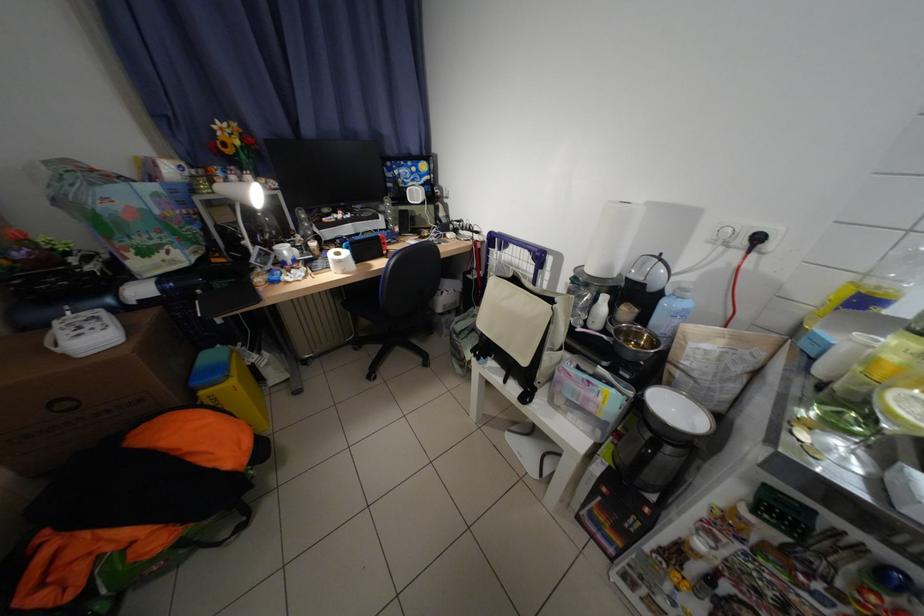
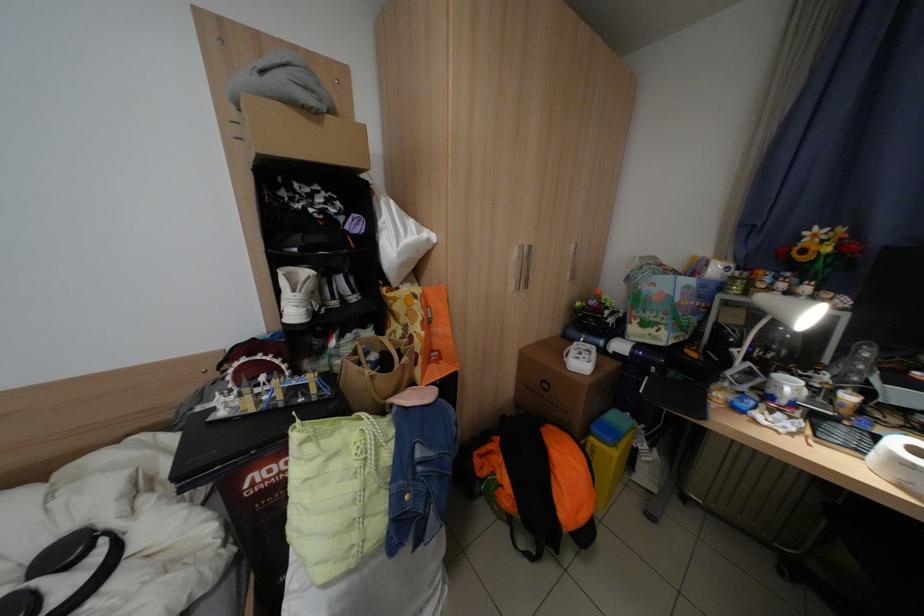
Find the pixel in the second image that matches (x=265, y=252) in the first image.

(752, 366)